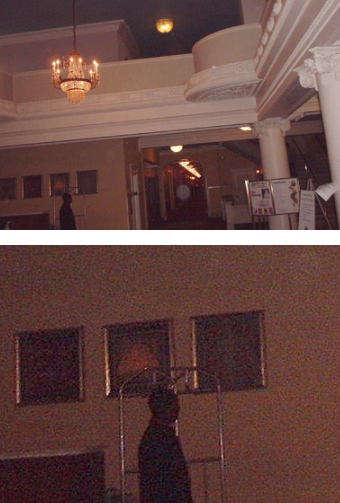
Where is `paintings`? paintings is located at coordinates (60, 373), (141, 341), (225, 341), (10, 184), (31, 178), (60, 179), (87, 184).